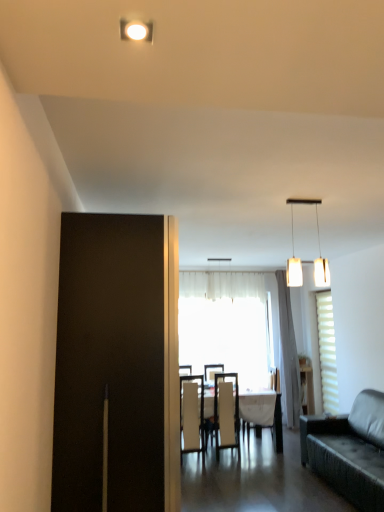
Question: Is white fabric chair at center, the first chair from the left, to the right of white sheer curtain at center from the viewer's perspective?

Choices:
 (A) yes
 (B) no

Answer: (B)

Question: Is white fabric chair at center, the first chair from the left, behind white sheer curtain at center?

Choices:
 (A) yes
 (B) no

Answer: (B)

Question: Is white fabric chair at center, the first chair from the left, shorter than white sheer curtain at center?

Choices:
 (A) yes
 (B) no

Answer: (A)

Question: From a real-world perspective, is white fabric chair at center, the first chair from the left, under white sheer curtain at center?

Choices:
 (A) yes
 (B) no

Answer: (A)

Question: Does white fabric chair at center, the first chair from the left, have a smaller size compared to white sheer curtain at center?

Choices:
 (A) yes
 (B) no

Answer: (A)

Question: From their relative heights in the image, would you say matte white cabinet at right is taller or shorter than white glossy table at center?

Choices:
 (A) short
 (B) tall

Answer: (B)

Question: Considering the positions of matte white cabinet at right and white glossy table at center in the image, is matte white cabinet at right wider or thinner than white glossy table at center?

Choices:
 (A) wide
 (B) thin

Answer: (B)

Question: Considering the positions of point tap(306, 374) and point tap(269, 414), is point tap(306, 374) closer or farther from the camera than point tap(269, 414)?

Choices:
 (A) closer
 (B) farther

Answer: (A)

Question: Is matte white cabinet at right spatially inside white glossy table at center, or outside of it?

Choices:
 (A) inside
 (B) outside

Answer: (B)

Question: Looking at the image, does white matte pendant lights at upper center seem bigger or smaller compared to matte white cabinet at right?

Choices:
 (A) big
 (B) small

Answer: (B)

Question: In terms of width, does white matte pendant lights at upper center look wider or thinner when compared to matte white cabinet at right?

Choices:
 (A) wide
 (B) thin

Answer: (B)

Question: Would you say white matte pendant lights at upper center is to the left or to the right of matte white cabinet at right in the picture?

Choices:
 (A) right
 (B) left

Answer: (B)

Question: Is white matte pendant lights at upper center in front of or behind matte white cabinet at right in the image?

Choices:
 (A) front
 (B) behind

Answer: (A)

Question: Is white sheer curtain at center inside the boundaries of leather couch at right, or outside?

Choices:
 (A) outside
 (B) inside

Answer: (A)

Question: Is white sheer curtain at center to the left or to the right of leather couch at right in the image?

Choices:
 (A) right
 (B) left

Answer: (B)